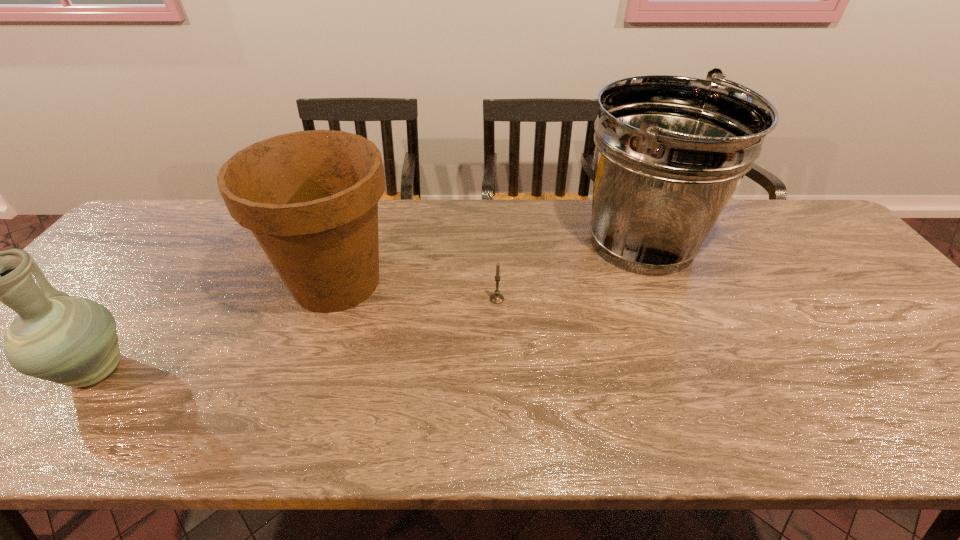
Identify the location of the rightmost object. (670, 151).

Locate an element on the screen. The height and width of the screenshot is (540, 960). bucket is located at coordinates (670, 151).

You are a GUI agent. You are given a task and a screenshot of the screen. Output one action in this format:
    pyautogui.click(x=<x>, y=<y>)
    Task: Click on the third object from right to left
    The width and height of the screenshot is (960, 540).
    Given the screenshot: What is the action you would take?
    pyautogui.click(x=310, y=198)

This screenshot has height=540, width=960. I want to click on pitcher, so click(72, 341).

Locate an element on the screen. the leftmost object is located at coordinates (72, 341).

You are a GUI agent. You are given a task and a screenshot of the screen. Output one action in this format:
    pyautogui.click(x=<x>, y=<y>)
    Task: Click on the third object from left to right
    This screenshot has width=960, height=540.
    Given the screenshot: What is the action you would take?
    pyautogui.click(x=496, y=298)

Where is `candle`? The width and height of the screenshot is (960, 540). candle is located at coordinates (496, 298).

The width and height of the screenshot is (960, 540). I want to click on free space located on the front of the bucket, so click(686, 346).

Where is `free space located on the right of the second object from left to right`? free space located on the right of the second object from left to right is located at coordinates (512, 282).

This screenshot has width=960, height=540. I want to click on vacant space located 0.310m on the handle side of the leftmost object, so click(184, 255).